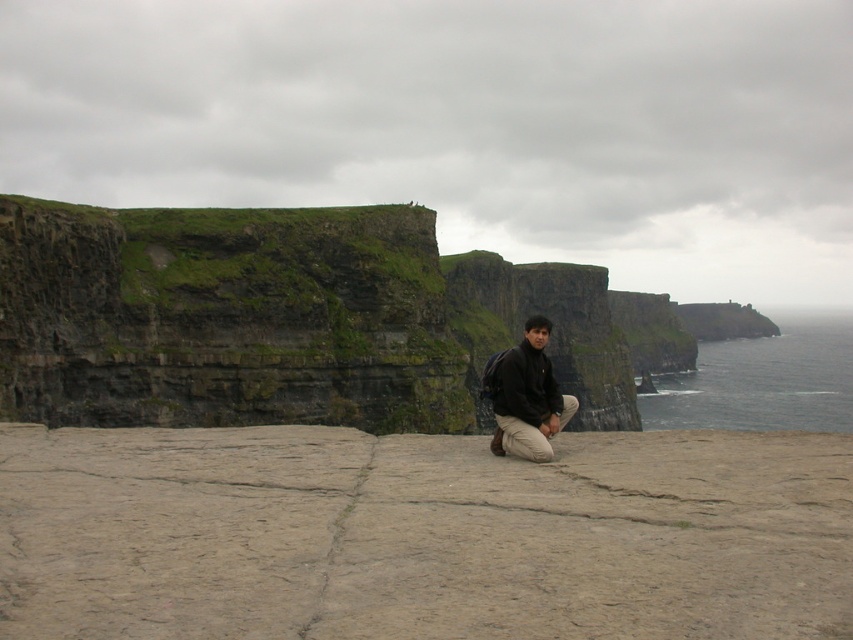
Question: Does brown stone at center have a greater width compared to dark brown leather jacket at center?

Choices:
 (A) yes
 (B) no

Answer: (A)

Question: Which point appears closest to the camera in this image?

Choices:
 (A) (137, 461)
 (B) (492, 369)

Answer: (A)

Question: Can you confirm if brown stone at center is positioned above dark brown leather jacket at center?

Choices:
 (A) no
 (B) yes

Answer: (A)

Question: Among these objects, which one is farthest from the camera?

Choices:
 (A) dark brown leather jacket at center
 (B) brown stone at center

Answer: (A)

Question: Can you confirm if brown stone at center is positioned above dark brown leather jacket at center?

Choices:
 (A) no
 (B) yes

Answer: (A)